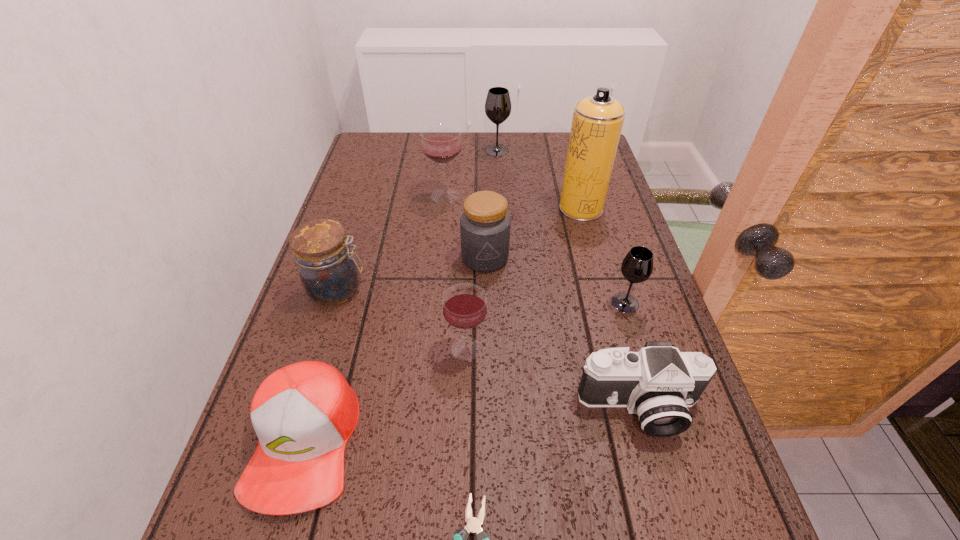
Locate an element on the screen. the second nearest wineglass is located at coordinates (637, 266).

Locate an element on the screen. The image size is (960, 540). camera is located at coordinates (658, 383).

Locate an element on the screen. baseball cap is located at coordinates (304, 414).

The width and height of the screenshot is (960, 540). Identify the location of red baseball cap. (304, 414).

The image size is (960, 540). I want to click on free location located on the front of the tallest object, so click(x=588, y=233).

This screenshot has height=540, width=960. I want to click on vacant point located 0.220m on the left of the third nearest wineglass, so (x=352, y=195).

You are a GUI agent. You are given a task and a screenshot of the screen. Output one action in this format:
    pyautogui.click(x=<x>, y=<y>)
    Task: Click on the vacant space located on the back of the farther gray wineglass
    
    Given the screenshot: What is the action you would take?
    pyautogui.click(x=496, y=136)

Find the location of a particular element. vacant space located on the surface of the gray jar near the warning symbol is located at coordinates (487, 403).

At what (x,y) coordinates should I click in order to perform the action: click on vacant space located 0.080m on the lid of the left jar. Please return your answer as a coordinate pair (x, y). Looking at the image, I should click on (400, 289).

You are a GUI agent. You are given a task and a screenshot of the screen. Output one action in this format:
    pyautogui.click(x=<x>, y=<y>)
    Task: Click on the free space located 0.130m on the back of the nearer red wineglass
    This screenshot has width=960, height=540.
    Given the screenshot: What is the action you would take?
    pyautogui.click(x=468, y=288)